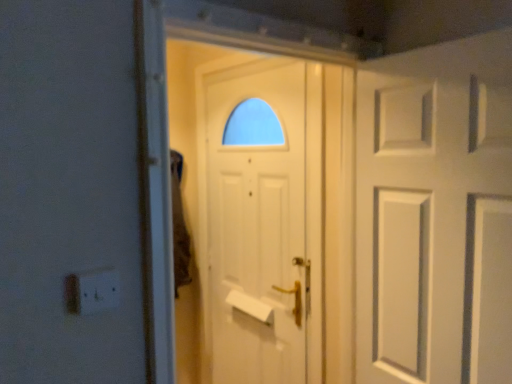
Question: Should I look upward or downward to see white matte door at right, the 1th door positioned from the right?

Choices:
 (A) up
 (B) down

Answer: (B)

Question: Does white plastic electric outlet at lower left come behind white matte door at center, which is the 1th door in back-to-front order?

Choices:
 (A) yes
 (B) no

Answer: (B)

Question: From the image's perspective, would you say white plastic electric outlet at lower left is positioned over white matte door at center, placed as the second door when sorted from right to left?

Choices:
 (A) yes
 (B) no

Answer: (A)

Question: From a real-world perspective, is white plastic electric outlet at lower left physically above white matte door at center, placed as the second door when sorted from right to left?

Choices:
 (A) yes
 (B) no

Answer: (A)

Question: Would you say white plastic electric outlet at lower left is a long distance from white matte door at center, placed as the second door when sorted from right to left?

Choices:
 (A) yes
 (B) no

Answer: (A)

Question: Considering the relative sizes of white plastic electric outlet at lower left and white matte door at center, placed as the second door when sorted from right to left, in the image provided, is white plastic electric outlet at lower left smaller than white matte door at center, placed as the second door when sorted from right to left,?

Choices:
 (A) no
 (B) yes

Answer: (B)

Question: Can you confirm if white plastic electric outlet at lower left is positioned to the left of white matte door at center, placed as the second door when sorted from right to left?

Choices:
 (A) yes
 (B) no

Answer: (A)

Question: Considering the relative sizes of white matte door at center, which is the 1th door in back-to-front order, and white plastic electric outlet at lower left in the image provided, is white matte door at center, which is the 1th door in back-to-front order, smaller than white plastic electric outlet at lower left?

Choices:
 (A) yes
 (B) no

Answer: (B)

Question: From the image's perspective, is white matte door at center, placed as the second door when sorted from right to left, beneath white plastic electric outlet at lower left?

Choices:
 (A) no
 (B) yes

Answer: (B)

Question: Is white matte door at center, placed as the second door when sorted from right to left, outside of white plastic electric outlet at lower left?

Choices:
 (A) yes
 (B) no

Answer: (A)

Question: From the image's perspective, is white matte door at center, which is counted as the 2th door, starting from the front, on top of white plastic electric outlet at lower left?

Choices:
 (A) no
 (B) yes

Answer: (A)

Question: Are white matte door at center, which is the 1th door from left to right, and white plastic electric outlet at lower left making contact?

Choices:
 (A) no
 (B) yes

Answer: (A)

Question: From a real-world perspective, is white matte door at center, which is the 1th door from left to right, over white plastic electric outlet at lower left?

Choices:
 (A) yes
 (B) no

Answer: (B)

Question: Considering the relative sizes of white matte door at right, the first door viewed from the front, and white plastic electric outlet at lower left in the image provided, is white matte door at right, the first door viewed from the front, bigger than white plastic electric outlet at lower left?

Choices:
 (A) no
 (B) yes

Answer: (B)